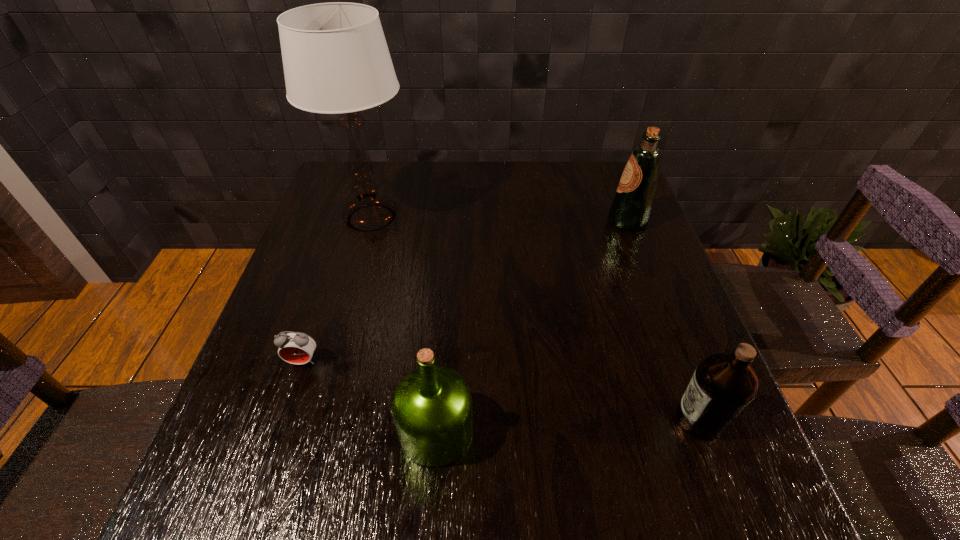
You are a GUI agent. You are given a task and a screenshot of the screen. Output one action in this format:
    pyautogui.click(x=<x>, y=<y>)
    Task: Click on the free space that is in between the table lamp and the third object from right to left
    The image size is (960, 540).
    Given the screenshot: What is the action you would take?
    pyautogui.click(x=403, y=325)

This screenshot has width=960, height=540. Find the location of `free point between the alarm clock and the tallest object`. free point between the alarm clock and the tallest object is located at coordinates (337, 289).

Find the location of a particular element. free point between the alarm clock and the tallest object is located at coordinates coord(337,289).

Locate an element on the screen. The image size is (960, 540). vacant area that lies between the shortest object and the table lamp is located at coordinates (337, 289).

This screenshot has height=540, width=960. In order to click on vacant area that lies between the table lamp and the leftmost olive oil in this screenshot , I will do `click(403, 325)`.

Identify which object is the nearest to the tallest object. Please provide its 2D coordinates. Your answer should be formatted as a tuple, i.e. [(x, y)], where the tuple contains the x and y coordinates of a point satisfying the conditions above.

[(297, 348)]

Where is `object that is the second nearest to the table lamp`? The image size is (960, 540). object that is the second nearest to the table lamp is located at coordinates [431, 406].

This screenshot has height=540, width=960. In order to click on olive oil that is the third closest to the table lamp in this screenshot , I will do `click(724, 384)`.

This screenshot has width=960, height=540. In order to click on olive oil that can be found as the third closest to the tallest object in this screenshot , I will do `click(724, 384)`.

Where is `vacant position in the image that satisfies the following two spatial constraints: 1. on the back side of the leftmost olive oil; 2. on the front-facing side of the tallest object`? Image resolution: width=960 pixels, height=540 pixels. vacant position in the image that satisfies the following two spatial constraints: 1. on the back side of the leftmost olive oil; 2. on the front-facing side of the tallest object is located at coordinates (452, 218).